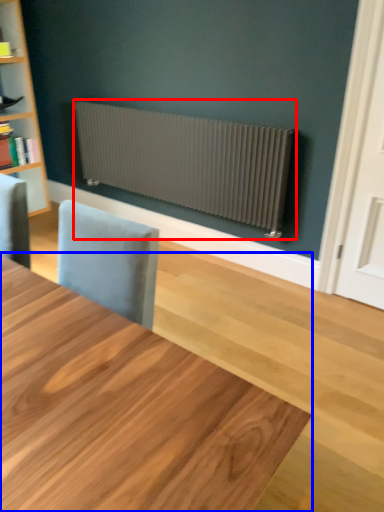
Question: Which object appears closest to the camera in this image, radiator (highlighted by a red box) or table (highlighted by a blue box)?

Choices:
 (A) radiator
 (B) table

Answer: (B)